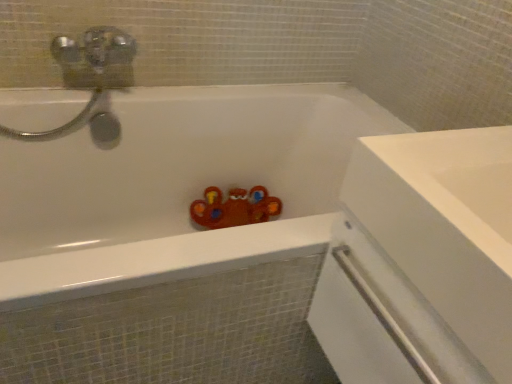
Find the location of a particular element. The width and height of the screenshot is (512, 384). clear plastic screen door at right is located at coordinates (382, 319).

What is the approximate height of clear plastic screen door at right?

It is 13.34 inches.

This screenshot has width=512, height=384. Describe the element at coordinates (382, 319) in the screenshot. I see `clear plastic screen door at right` at that location.

What do you see at coordinates (176, 185) in the screenshot? I see `white glossy bathtub at center` at bounding box center [176, 185].

Identify the location of white glossy bathtub at center. The image size is (512, 384). (176, 185).

This screenshot has width=512, height=384. Identify the location of clear plastic screen door at right. (382, 319).

Which is more to the right, clear plastic screen door at right or white glossy bathtub at center?

clear plastic screen door at right.

Who is more distant, clear plastic screen door at right or white glossy bathtub at center?

white glossy bathtub at center is behind.

Does point (351, 383) lie behind point (11, 281)?

Yes, point (351, 383) is farther from viewer.

From the image's perspective, between clear plastic screen door at right and white glossy bathtub at center, which one is located above?

white glossy bathtub at center appears higher in the image.

From a real-world perspective, is clear plastic screen door at right positioned over white glossy bathtub at center based on gravity?

Indeed, from a real-world perspective, clear plastic screen door at right stands above white glossy bathtub at center.

In terms of width, does clear plastic screen door at right look wider or thinner when compared to white glossy bathtub at center?

Clearly, clear plastic screen door at right has less width compared to white glossy bathtub at center.

Does clear plastic screen door at right have a greater height compared to white glossy bathtub at center?

Incorrect, the height of clear plastic screen door at right is not larger of that of white glossy bathtub at center.

In terms of size, does clear plastic screen door at right appear bigger or smaller than white glossy bathtub at center?

Considering their sizes, clear plastic screen door at right takes up less space than white glossy bathtub at center.

Could white glossy bathtub at center be considered to be inside clear plastic screen door at right?

No.

Would you say clear plastic screen door at right is a long distance from white glossy bathtub at center?

A: No, clear plastic screen door at right is in close proximity to white glossy bathtub at center.

Is clear plastic screen door at right turned away from white glossy bathtub at center?

No, clear plastic screen door at right is not facing the opposite direction of white glossy bathtub at center.

What's the angular difference between clear plastic screen door at right and white glossy bathtub at center's facing directions?

89.8 degrees.

At what (x,y) coordinates should I click in order to perform the action: click on bathtub lying on the left of clear plastic screen door at right. Please return your answer as a coordinate pair (x, y). This screenshot has height=384, width=512. Looking at the image, I should click on (176, 185).

Considering the positions of objects white glossy bathtub at center and clear plastic screen door at right in the image provided, who is more to the right, white glossy bathtub at center or clear plastic screen door at right?

clear plastic screen door at right is more to the right.

Which object is further away from the camera, white glossy bathtub at center or clear plastic screen door at right?

white glossy bathtub at center is further from the camera.

Does point (15, 302) lie in front of point (417, 298)?

No.

From the image's perspective, between white glossy bathtub at center and clear plastic screen door at right, who is located below?

clear plastic screen door at right is shown below in the image.

From a real-world perspective, is white glossy bathtub at center below clear plastic screen door at right?

Correct, in the physical world, white glossy bathtub at center is lower than clear plastic screen door at right.

Considering the sizes of objects white glossy bathtub at center and clear plastic screen door at right in the image provided, who is wider, white glossy bathtub at center or clear plastic screen door at right?

With larger width is white glossy bathtub at center.

Between white glossy bathtub at center and clear plastic screen door at right, which one has more height?

Standing taller between the two is white glossy bathtub at center.

Consider the image. Does white glossy bathtub at center have a smaller size compared to clear plastic screen door at right?

No, white glossy bathtub at center is not smaller than clear plastic screen door at right.

Is white glossy bathtub at center completely or partially outside of clear plastic screen door at right?

Yes, white glossy bathtub at center is located beyond the bounds of clear plastic screen door at right.

Is white glossy bathtub at center next to clear plastic screen door at right and touching it?

No, white glossy bathtub at center is not next to clear plastic screen door at right.

Could you tell me if white glossy bathtub at center is facing clear plastic screen door at right?

Yes, white glossy bathtub at center is facing clear plastic screen door at right.

What's the angular difference between white glossy bathtub at center and clear plastic screen door at right's facing directions?

white glossy bathtub at center and clear plastic screen door at right are facing 89.8 degrees away from each other.

Measure the distance from white glossy bathtub at center to clear plastic screen door at right.

white glossy bathtub at center and clear plastic screen door at right are 27.77 inches apart from each other.

Image resolution: width=512 pixels, height=384 pixels. Identify the location of screen door in front of the white glossy bathtub at center. (382, 319).

You are a GUI agent. You are given a task and a screenshot of the screen. Output one action in this format:
    pyautogui.click(x=<x>, y=<y>)
    Task: Click on the screen door that appears in front of the white glossy bathtub at center
    
    Given the screenshot: What is the action you would take?
    pyautogui.click(x=382, y=319)

Locate an element on the screen. bathtub beneath the clear plastic screen door at right (from a real-world perspective) is located at coordinates (176, 185).